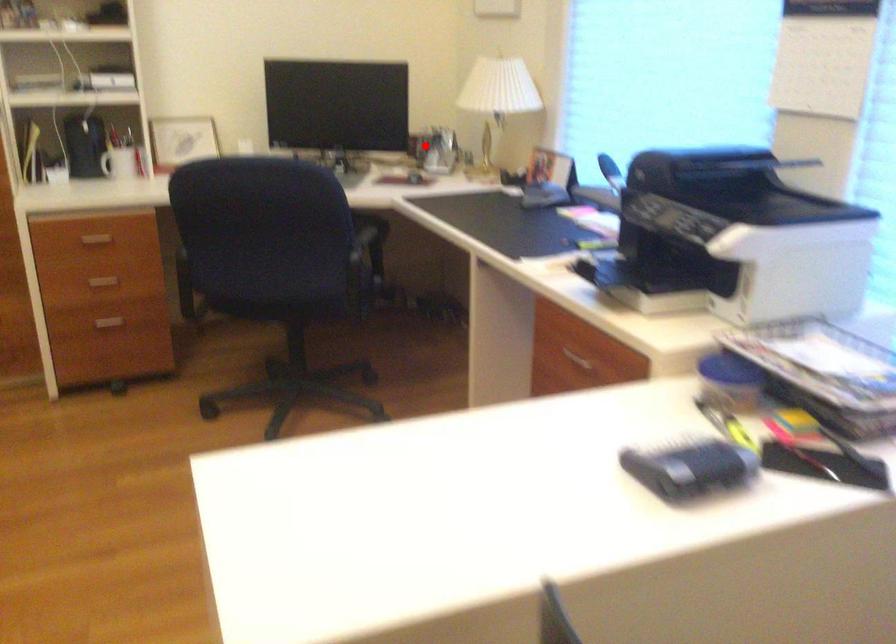
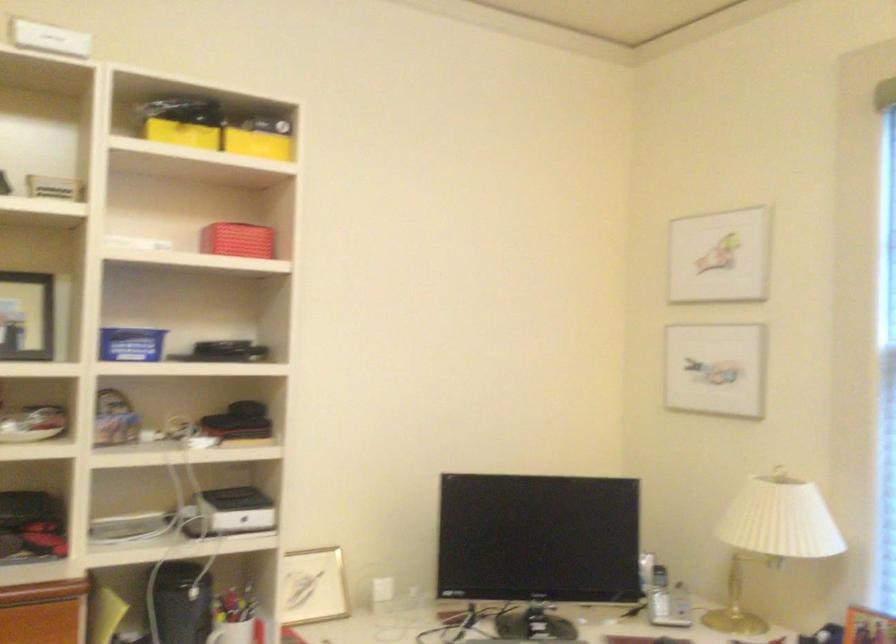
Find the pixel in the second image that matches the highlighted location in the first image.

(659, 594)